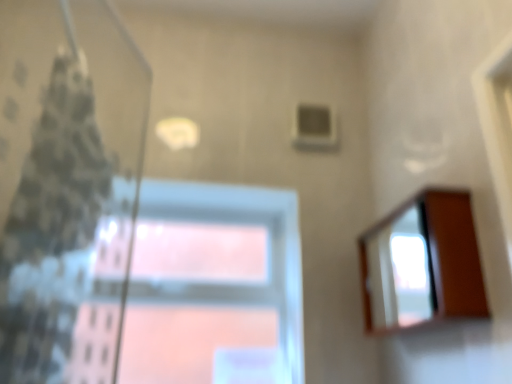
Where is `transparent glass window at center`? transparent glass window at center is located at coordinates (214, 287).

What is the approximate height of transparent glass window at center?

It is 76.92 centimeters.

Find the location of a particular element. patterned fabric shower curtain at left is located at coordinates (51, 231).

You are a GUI agent. You are given a task and a screenshot of the screen. Output one action in this format:
    pyautogui.click(x=<x>, y=<y>)
    Task: Click on the mirror in front of the transparent glass window at center
    The image size is (512, 384).
    Given the screenshot: What is the action you would take?
    pyautogui.click(x=422, y=264)

Is point (132, 339) in front of point (418, 240)?

Yes, point (132, 339) is closer to viewer.

Between transparent glass window at center and wooden mirror at right, which one has larger width?

With larger width is wooden mirror at right.

Which object is wider, wooden mirror at right or patterned fabric shower curtain at left?

Wider between the two is patterned fabric shower curtain at left.

Based on the photo, is wooden mirror at right smaller than patterned fabric shower curtain at left?

Yes, wooden mirror at right is smaller than patterned fabric shower curtain at left.

How different are the orientations of wooden mirror at right and patterned fabric shower curtain at left in degrees?

There is a 179-degree angle between the facing directions of wooden mirror at right and patterned fabric shower curtain at left.

Where is `mirror that appears below the patterned fabric shower curtain at left (from the image's perspective)`? mirror that appears below the patterned fabric shower curtain at left (from the image's perspective) is located at coordinates (422, 264).

Considering the positions of objects patterned fabric shower curtain at left and wooden mirror at right in the image provided, who is more to the right, patterned fabric shower curtain at left or wooden mirror at right?

wooden mirror at right.

Which object is wider, patterned fabric shower curtain at left or wooden mirror at right?

With larger width is patterned fabric shower curtain at left.

Is the depth of patterned fabric shower curtain at left greater than that of wooden mirror at right?

No, patterned fabric shower curtain at left is closer to the viewer.

From a real-world perspective, is patterned fabric shower curtain at left over wooden mirror at right?

Yes.

Which object is wider, wooden mirror at right or transparent glass window at center?

Wider between the two is wooden mirror at right.

Where is `window on the left of wooden mirror at right`? window on the left of wooden mirror at right is located at coordinates (214, 287).

In the image, is wooden mirror at right on the left side or the right side of transparent glass window at center?

wooden mirror at right is to the right of transparent glass window at center.

Which object is wider, patterned fabric shower curtain at left or transparent glass window at center?

With larger width is patterned fabric shower curtain at left.

Measure the distance from patterned fabric shower curtain at left to transparent glass window at center.

They are 59.66 centimeters apart.

From the image's perspective, which is above, patterned fabric shower curtain at left or transparent glass window at center?

patterned fabric shower curtain at left, from the image's perspective.

Is patterned fabric shower curtain at left turned away from transparent glass window at center?

That's not correct — patterned fabric shower curtain at left is not looking away from transparent glass window at center.

Which is behind, point (106, 230) or point (70, 120)?

Point (70, 120)

Is transparent glass window at center in front of patterned fabric shower curtain at left?

No, it is not.

Looking at this image, can you confirm if transparent glass window at center is positioned to the right of patterned fabric shower curtain at left?

Indeed, transparent glass window at center is positioned on the right side of patterned fabric shower curtain at left.

Between transparent glass window at center and patterned fabric shower curtain at left, which one has smaller width?

Thinner between the two is transparent glass window at center.

Identify the location of window positioned vertically above the wooden mirror at right (from a real-world perspective). The width and height of the screenshot is (512, 384). (214, 287).

This screenshot has width=512, height=384. Find the location of `shower curtain on the left of the wooden mirror at right`. shower curtain on the left of the wooden mirror at right is located at coordinates (51, 231).

Which object lies further to the anchor point transparent glass window at center, patterned fabric shower curtain at left or wooden mirror at right?

Among the two, wooden mirror at right is located further to transparent glass window at center.

Estimate the real-world distances between objects in this image. Which object is further from patterned fabric shower curtain at left, transparent glass window at center or wooden mirror at right?

wooden mirror at right is further to patterned fabric shower curtain at left.

Which object lies nearer to the anchor point patterned fabric shower curtain at left, wooden mirror at right or transparent glass window at center?

Among the two, transparent glass window at center is located nearer to patterned fabric shower curtain at left.

Considering their positions, is patterned fabric shower curtain at left positioned further to wooden mirror at right than transparent glass window at center?

Based on the image, patterned fabric shower curtain at left appears to be further to wooden mirror at right.

Based on their spatial positions, is wooden mirror at right or patterned fabric shower curtain at left further from transparent glass window at center?

wooden mirror at right lies further to transparent glass window at center than the other object.

Based on their spatial positions, is transparent glass window at center or patterned fabric shower curtain at left further from wooden mirror at right?

The object further to wooden mirror at right is patterned fabric shower curtain at left.

The height and width of the screenshot is (384, 512). I want to click on window located between patterned fabric shower curtain at left and wooden mirror at right in the left-right direction, so click(x=214, y=287).